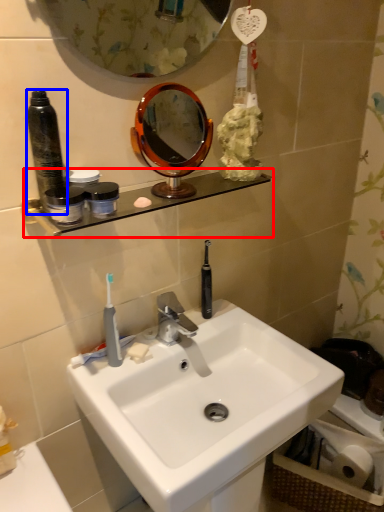
Question: Among these objects, which one is nearest to the camera, shelve (highlighted by a red box) or bottle (highlighted by a blue box)?

Choices:
 (A) shelve
 (B) bottle

Answer: (B)